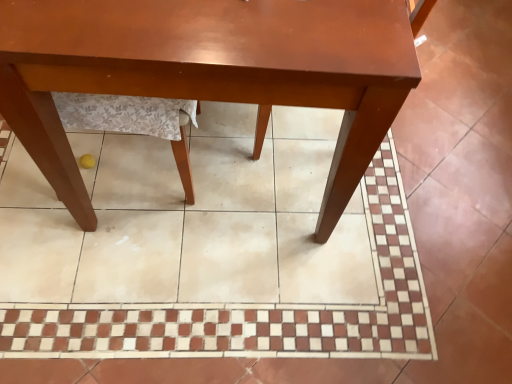
Find the location of a particular element. The height and width of the screenshot is (384, 512). free spot in front of matte wood table at center is located at coordinates (203, 300).